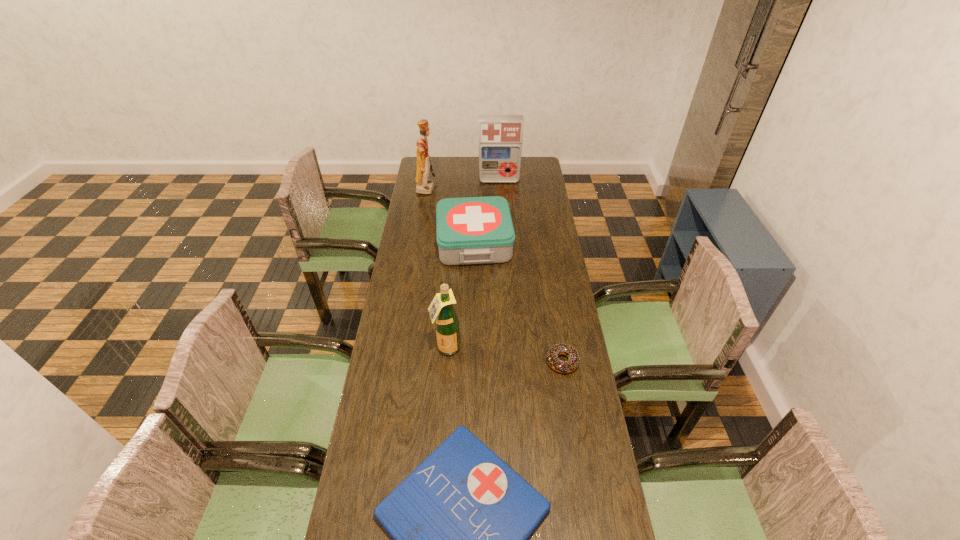
Identify the location of vacant space located on the left of the doughnut. (445, 362).

Identify the location of object present at the far edge. (500, 136).

At what (x,y) coordinates should I click in order to perform the action: click on nutcracker at the left edge. Please return your answer as a coordinate pair (x, y). This screenshot has height=540, width=960. Looking at the image, I should click on (424, 186).

You are a GUI agent. You are given a task and a screenshot of the screen. Output one action in this format:
    pyautogui.click(x=<x>, y=<y>)
    Task: Click on the first-aid kit at the left edge
    Image resolution: width=960 pixels, height=540 pixels.
    Given the screenshot: What is the action you would take?
    pyautogui.click(x=474, y=230)

You are a GUI agent. You are given a task and a screenshot of the screen. Output one action in this format:
    pyautogui.click(x=<x>, y=<y>)
    Task: Click on the first-aid kit that is at the right edge
    
    Given the screenshot: What is the action you would take?
    pyautogui.click(x=500, y=136)

This screenshot has height=540, width=960. I want to click on doughnut that is at the right edge, so click(x=560, y=366).

The width and height of the screenshot is (960, 540). In order to click on object that is at the far right corner in this screenshot , I will do `click(500, 136)`.

The height and width of the screenshot is (540, 960). In the image, there is a desktop. Find the location of `vacant space at the far edge`. vacant space at the far edge is located at coordinates point(461,160).

Image resolution: width=960 pixels, height=540 pixels. Identify the location of free location at the left edge of the desktop. (438, 190).

The image size is (960, 540). What are the coordinates of `blank space at the right edge of the desktop` in the screenshot? It's located at (581, 390).